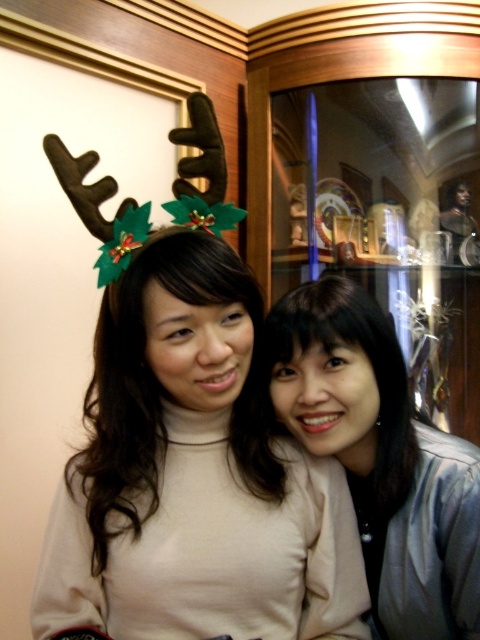
You are a photographer adjusting the lighting for a photo shoot. You notice the matte brown antlers at center and the matte beige sweater at center. Which object should you focus on first if you want to adjust the lighting for the closest object to the camera?

The matte brown antlers at center is in front of the matte beige sweater at center, so you should focus on adjusting the lighting for the matte brown antlers at center first since it is closer to the camera.

You are taking a photo of two people standing in front of a wooden frame. You notice the matte brown antlers at center and the matte beige sweater at center. Which object is positioned higher in the image?

The matte brown antlers at center are positioned higher than the matte beige sweater at center.

You are a photographer adjusting the camera settings to capture the two people in the scene. Since the matte brown antlers at center and the matte beige sweater at center are both in focus, which object will require a wider aperture setting to ensure they remain sharp?

The matte brown antlers at center has a larger width than the matte beige sweater at center, so a wider aperture would be needed to keep both in focus due to the larger size of the antlers.